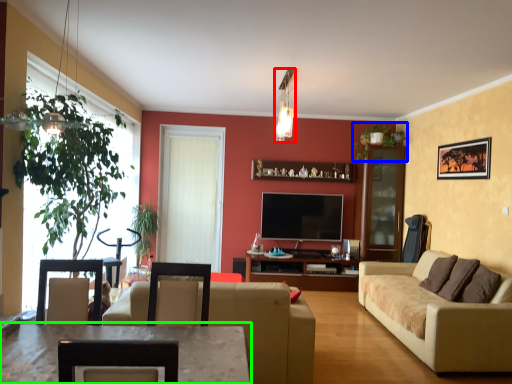
Question: Considering the real-world distances, which object is farthest from light fixture (highlighted by a red box)? plant (highlighted by a blue box) or table (highlighted by a green box)?

Choices:
 (A) plant
 (B) table

Answer: (B)